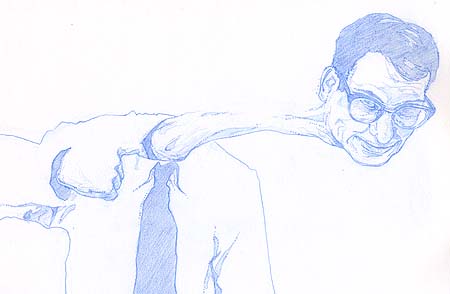
This screenshot has height=294, width=450. Identify the location of artwork. (397, 27).